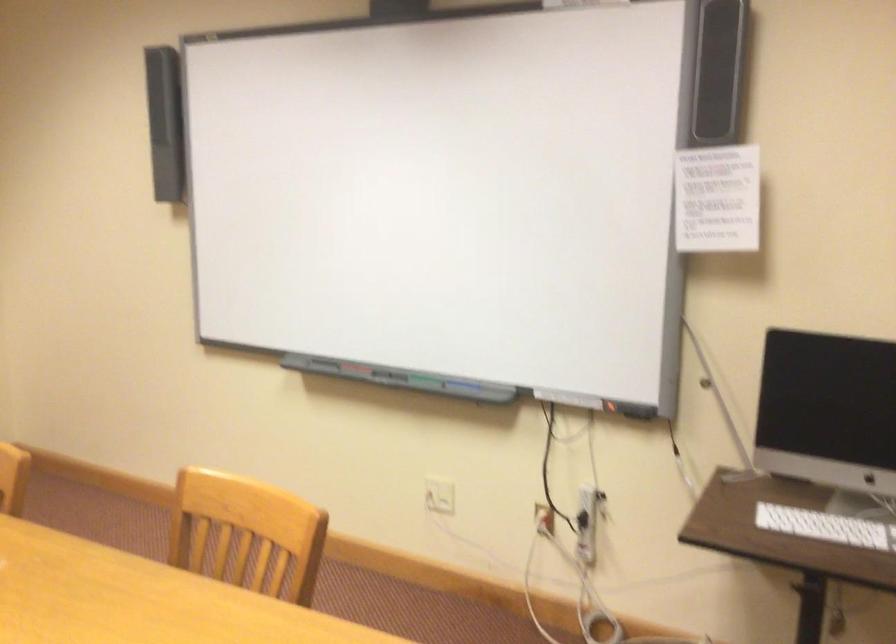
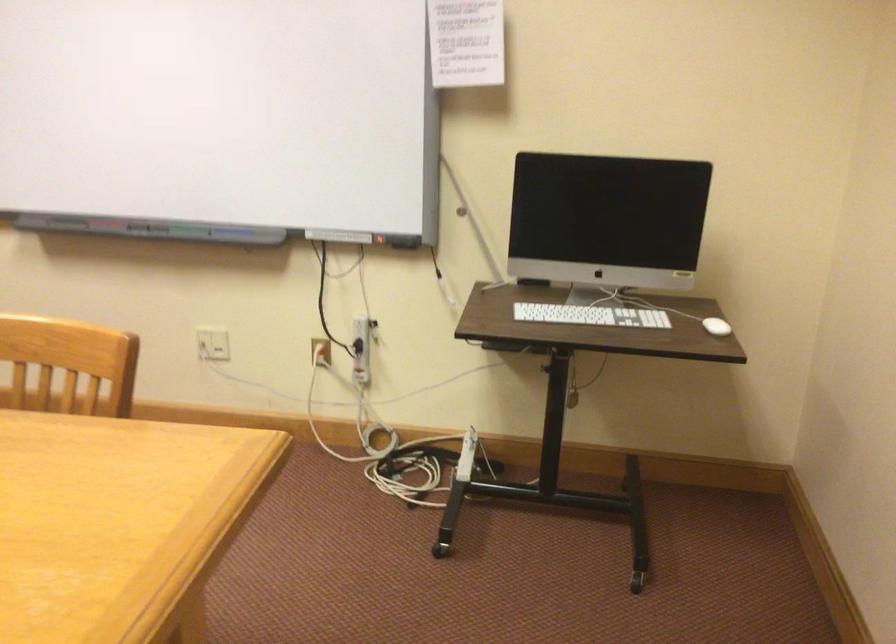
Locate, in the second image, the point that corresponds to pixel 424 383 in the first image.

(187, 230)